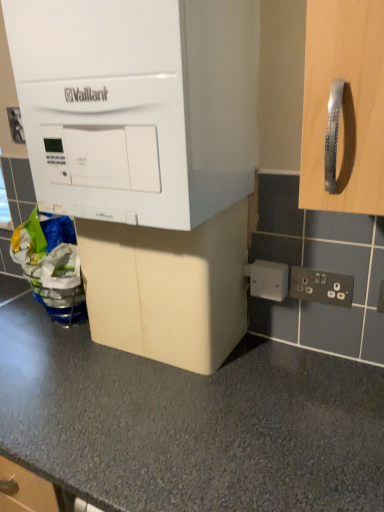
Question: From a real-world perspective, is white matte vaillant boiler at upper left, arranged as the first cabinetry when viewed from the top, physically above black plastic electrical outlet at lower right, which ranks as the 3th electric outlet in left-to-right order?

Choices:
 (A) no
 (B) yes

Answer: (B)

Question: Does white matte vaillant boiler at upper left, arranged as the first cabinetry when viewed from the top, appear on the left side of black plastic electrical outlet at lower right, arranged as the 3th electric outlet when viewed from the top?

Choices:
 (A) yes
 (B) no

Answer: (A)

Question: From a real-world perspective, is white matte vaillant boiler at upper left, arranged as the first cabinetry when viewed from the top, physically below black plastic electrical outlet at lower right, which ranks as the 3th electric outlet in left-to-right order?

Choices:
 (A) yes
 (B) no

Answer: (B)

Question: From the image's perspective, is white matte vaillant boiler at upper left, arranged as the first cabinetry when viewed from the top, above black plastic electrical outlet at lower right, acting as the 3th electric outlet starting from the back?

Choices:
 (A) no
 (B) yes

Answer: (B)

Question: Can you confirm if white matte vaillant boiler at upper left, arranged as the first cabinetry when viewed from the top, is wider than black plastic electrical outlet at lower right, marked as the 1th electric outlet in a right-to-left arrangement?

Choices:
 (A) no
 (B) yes

Answer: (B)

Question: Is white matte vaillant boiler at upper left, arranged as the first cabinetry when viewed from the top, far away from black plastic electrical outlet at lower right, the first electric outlet from the bottom?

Choices:
 (A) no
 (B) yes

Answer: (A)

Question: Is beige matte cabinet at center, which appears as the 2th cabinetry when viewed from the top, shorter than white plastic electric outlet at upper left, acting as the first electric outlet starting from the left?

Choices:
 (A) no
 (B) yes

Answer: (A)

Question: Can you confirm if beige matte cabinet at center, acting as the 1th cabinetry starting from the bottom, is positioned to the right of white plastic electric outlet at upper left, which is counted as the 1th electric outlet, starting from the top?

Choices:
 (A) yes
 (B) no

Answer: (A)

Question: Can you confirm if beige matte cabinet at center, acting as the 1th cabinetry starting from the bottom, is thinner than white plastic electric outlet at upper left, positioned as the 3th electric outlet in front-to-back order?

Choices:
 (A) yes
 (B) no

Answer: (B)

Question: Is beige matte cabinet at center, which appears as the 2th cabinetry when viewed from the top, wider than white plastic electric outlet at upper left, which is counted as the 1th electric outlet, starting from the top?

Choices:
 (A) yes
 (B) no

Answer: (A)

Question: Is beige matte cabinet at center, which appears as the 2th cabinetry when viewed from the top, positioned beyond the bounds of white plastic electric outlet at upper left, the 3th electric outlet positioned from the right?

Choices:
 (A) no
 (B) yes

Answer: (B)

Question: Is there a large distance between beige matte cabinet at center, acting as the 1th cabinetry starting from the bottom, and white plastic electric outlet at upper left, the 3th electric outlet positioned from the right?

Choices:
 (A) yes
 (B) no

Answer: (B)

Question: Would you say white plastic electric outlet at upper left, which appears as the 1th electric outlet when viewed from the back, is part of black plastic electrical outlet at lower right, which appears as the first electric outlet when viewed from the front,'s contents?

Choices:
 (A) yes
 (B) no

Answer: (B)